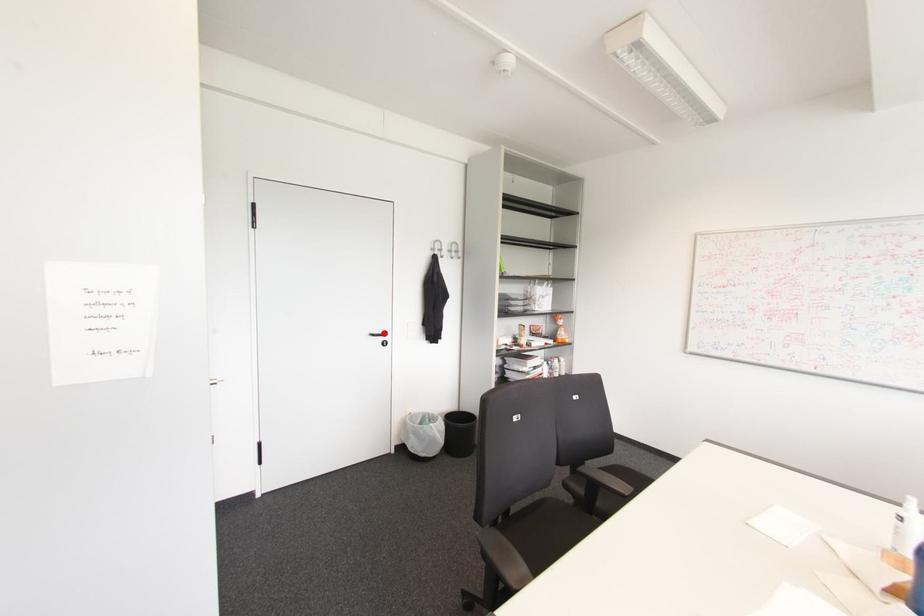
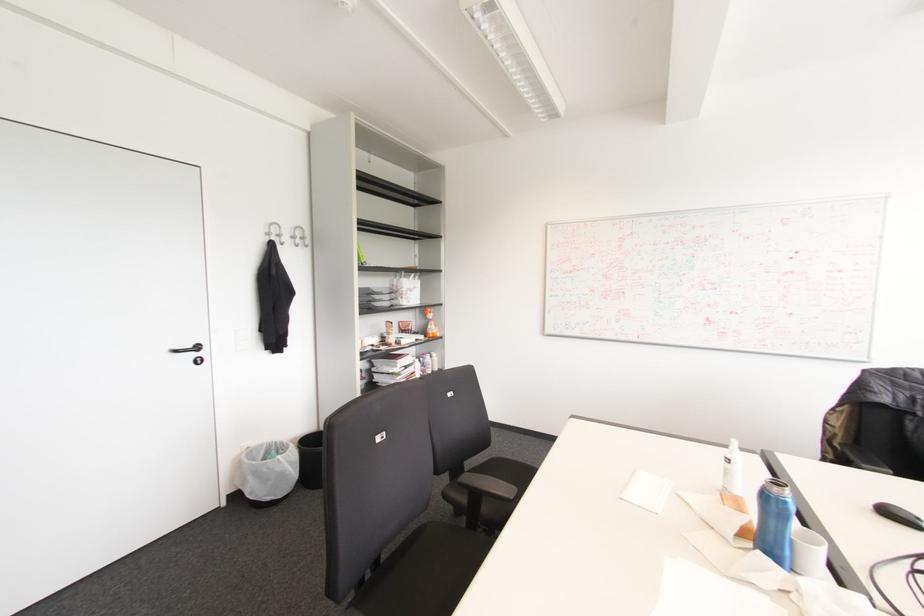
Question: I am providing you with two images of the same scene from different viewpoints. A red point is marked on the first image. Can you still see the location of the red point in image 2?

Choices:
 (A) Yes
 (B) No

Answer: (A)